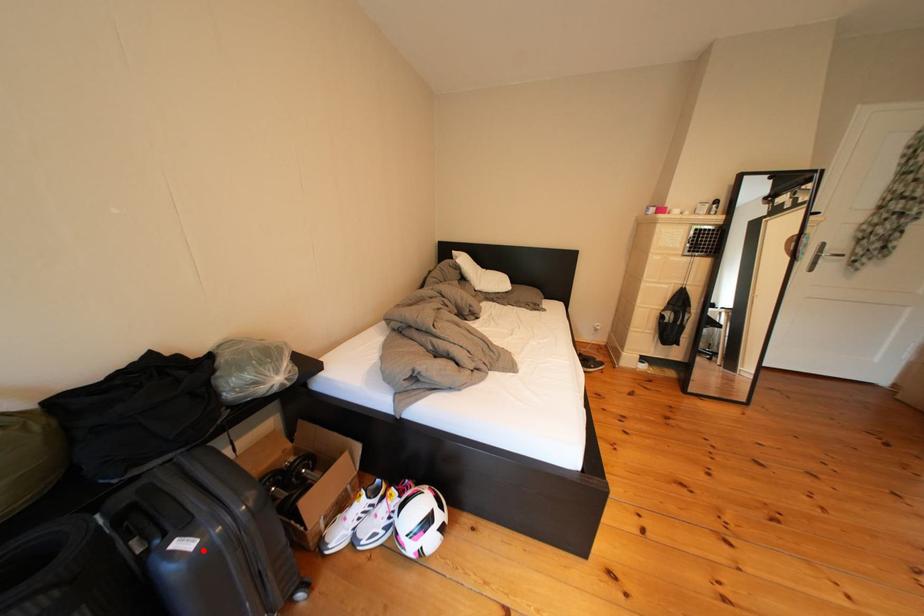
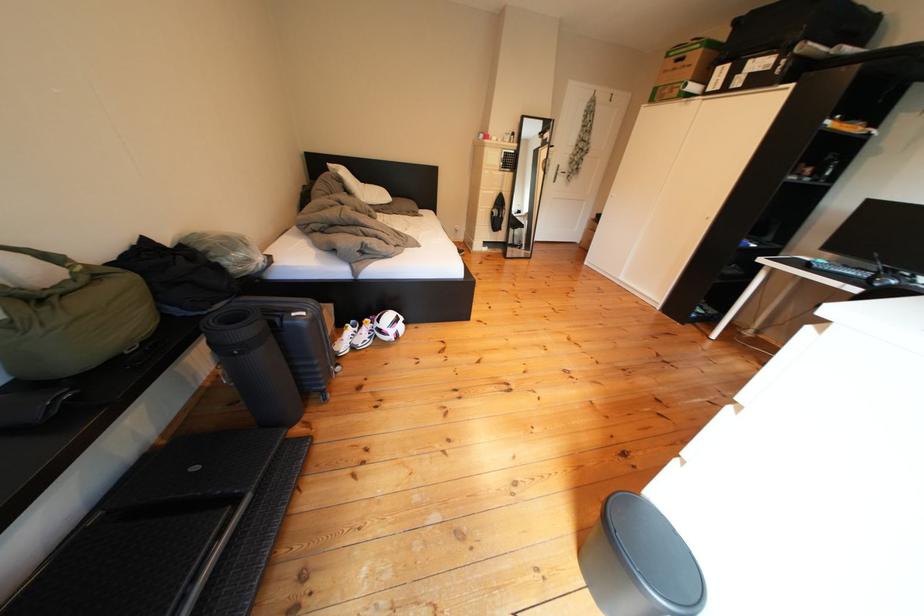
Question: I am providing you with two images of the same scene from different viewpoints. A red point is marked on the first image. At the location where the point appears in image 1, is it still visible in image 2?

Choices:
 (A) Yes
 (B) No

Answer: (A)